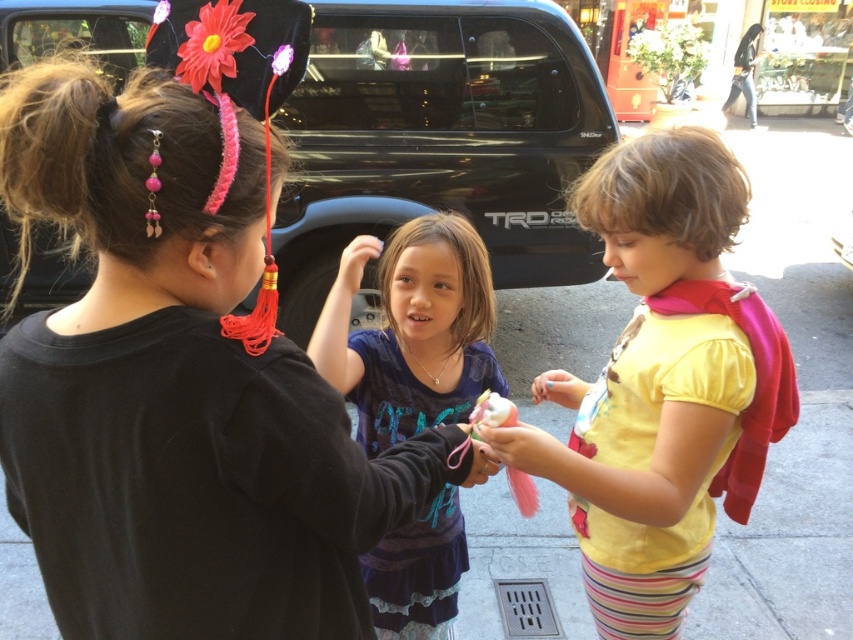
Question: Can you confirm if yellow cotton shirt at center is positioned below purple cotton shirt at center?

Choices:
 (A) yes
 (B) no

Answer: (B)

Question: Can you confirm if yellow cotton shirt at center is smaller than purple cotton shirt at center?

Choices:
 (A) yes
 (B) no

Answer: (B)

Question: Which point is farther from the camera taking this photo?

Choices:
 (A) (405, 374)
 (B) (688, 416)

Answer: (A)

Question: Does yellow cotton shirt at center appear over purple cotton shirt at center?

Choices:
 (A) yes
 (B) no

Answer: (A)